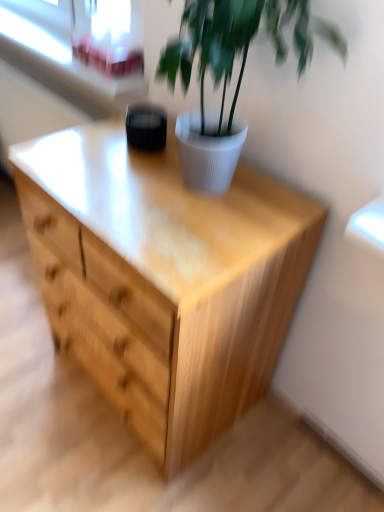
Identify the location of vacant region to the left of natural wood chest of drawers at center. This screenshot has height=512, width=384. click(33, 373).